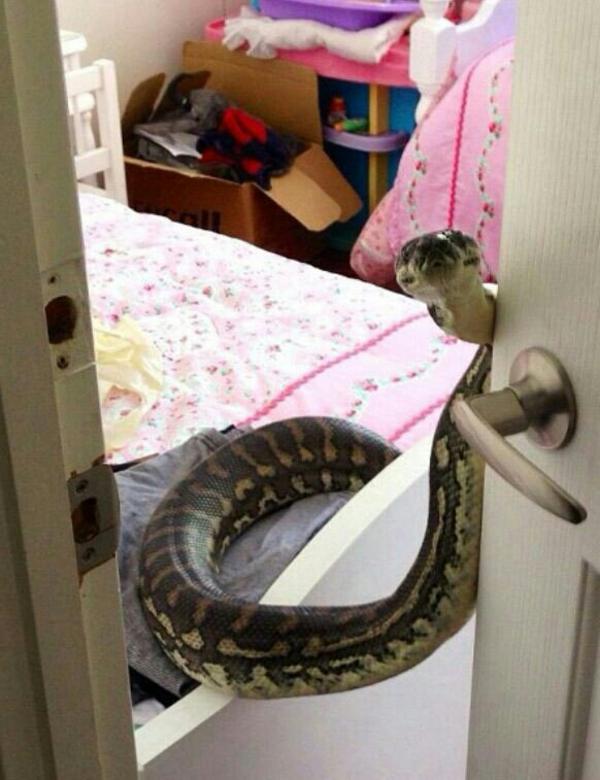
This screenshot has height=780, width=600. What are the coordinates of `bed` in the screenshot? It's located at (372, 516).